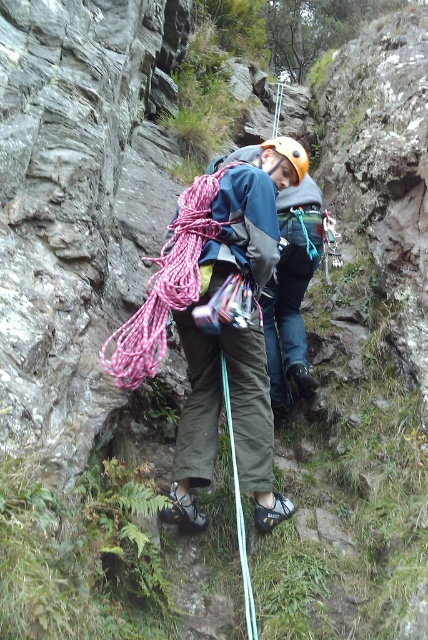
Question: Does pink nylon rope at center have a larger size compared to yellow matte helmet at center?

Choices:
 (A) yes
 (B) no

Answer: (B)

Question: Is pink nylon rope at center to the left of yellow matte helmet at center from the viewer's perspective?

Choices:
 (A) no
 (B) yes

Answer: (B)

Question: Which of the following is the closest to the observer?

Choices:
 (A) matte blue jacket at center
 (B) pink nylon rope at center
 (C) yellow matte helmet at center

Answer: (B)

Question: Which object appears closest to the camera in this image?

Choices:
 (A) yellow matte helmet at center
 (B) pink nylon rope at center

Answer: (B)

Question: Which of the following is the farthest from the observer?

Choices:
 (A) yellow matte helmet at center
 (B) pink nylon rope at center
 (C) matte blue jacket at center

Answer: (A)

Question: Can you confirm if matte blue jacket at center is bigger than pink nylon rope at center?

Choices:
 (A) no
 (B) yes

Answer: (A)